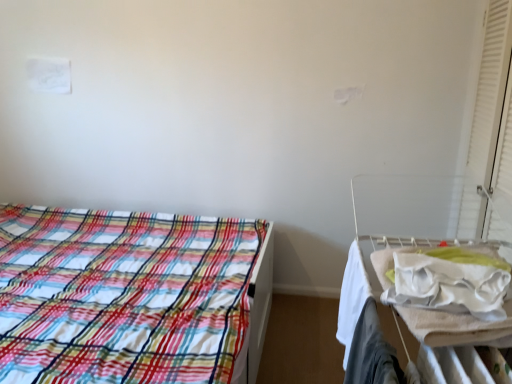
Describe the element at coordinates (422, 312) in the screenshot. This screenshot has width=512, height=384. I see `white fabric hospital bed at right` at that location.

Where is `white fabric at right`? Image resolution: width=512 pixels, height=384 pixels. white fabric at right is located at coordinates (372, 352).

The image size is (512, 384). I want to click on plaid fabric bed at left, so click(x=126, y=295).

In order to click on white fabric hospital bed at right in this screenshot , I will do `click(422, 312)`.

From a real-world perspective, which is physically above, white fabric at right or plaid fabric bed at left?

In real-world perspective, white fabric at right is above.

From the image's perspective, which one is positioned higher, white fabric at right or plaid fabric bed at left?

white fabric at right is shown above in the image.

Looking at this image, does white fabric at right have a lesser width compared to plaid fabric bed at left?

Yes.

Could you tell me if white fabric at right is turned towards plaid fabric bed at left?

No, white fabric at right does not turn towards plaid fabric bed at left.

Based on the photo, is plaid fabric bed at left surrounded by white matte curtain at right?

Actually, plaid fabric bed at left is outside white matte curtain at right.

Is white matte curtain at right touching plaid fabric bed at left?

No.

Is white matte curtain at right oriented away from plaid fabric bed at left?

No, plaid fabric bed at left is not at the back of white matte curtain at right.

Is white matte curtain at right in front of plaid fabric bed at left?

No, white matte curtain at right is further to the viewer.

From a real-world perspective, which is physically below, white fabric hospital bed at right or plaid fabric bed at left?

plaid fabric bed at left is physically lower.

Is white fabric hospital bed at right wider or thinner than plaid fabric bed at left?

In the image, white fabric hospital bed at right appears to be more narrow than plaid fabric bed at left.

Is white fabric hospital bed at right located outside plaid fabric bed at left?

Absolutely, white fabric hospital bed at right is external to plaid fabric bed at left.

From the picture: From the image's perspective, does white fabric hospital bed at right appear lower than plaid fabric bed at left?

Yes, from the image's perspective, white fabric hospital bed at right is below plaid fabric bed at left.

Is point (482, 133) in front of point (398, 374)?

No, (482, 133) is behind (398, 374).

Considering the positions of objects white matte curtain at right and white fabric at right in the image provided, who is in front, white matte curtain at right or white fabric at right?

white fabric at right is more forward.

Would you say white matte curtain at right contains white fabric at right?

No, white fabric at right is not inside white matte curtain at right.

Looking at this image, looking at the image, does white matte curtain at right seem bigger or smaller compared to white fabric at right?

Considering their sizes, white matte curtain at right takes up more space than white fabric at right.

Based on the photo, which of these two, plaid fabric bed at left or white fabric at right, is bigger?

Bigger between the two is plaid fabric bed at left.

Is plaid fabric bed at left facing towards white fabric at right?

No, plaid fabric bed at left is not facing towards white fabric at right.

Is plaid fabric bed at left positioned far away from white fabric at right?

Yes, plaid fabric bed at left and white fabric at right are located far from each other.

Is plaid fabric bed at left behind white matte curtain at right?

No, the depth of plaid fabric bed at left is less than that of white matte curtain at right.

From the image's perspective, is plaid fabric bed at left located beneath white matte curtain at right?

Indeed, from the image's perspective, plaid fabric bed at left is shown beneath white matte curtain at right.

Is plaid fabric bed at left thinner than white matte curtain at right?

No.

Is white matte curtain at right at the back of plaid fabric bed at left?

That's not correct — plaid fabric bed at left is not looking away from white matte curtain at right.

Is white fabric at right a part of white fabric hospital bed at right?

Indeed, white fabric at right is located within white fabric hospital bed at right.

In terms of size, does white fabric hospital bed at right appear bigger or smaller than white fabric at right?

Considering their sizes, white fabric hospital bed at right takes up more space than white fabric at right.

In the scene shown: In the image, is white fabric hospital bed at right on the left side or the right side of white fabric at right?

From the image, it's evident that white fabric hospital bed at right is to the right of white fabric at right.

Where is `clothing in front of the plaid fabric bed at left`? The height and width of the screenshot is (384, 512). clothing in front of the plaid fabric bed at left is located at coordinates (372, 352).

Where is `bed located underneath the white matte curtain at right (from a real-world perspective)`? bed located underneath the white matte curtain at right (from a real-world perspective) is located at coordinates (126, 295).

When comparing their distances from plaid fabric bed at left, does white matte curtain at right or white fabric at right seem closer?

Based on the image, white fabric at right appears to be nearer to plaid fabric bed at left.

Looking at the image, which one is located further to white fabric hospital bed at right, white matte curtain at right or plaid fabric bed at left?

Based on the image, plaid fabric bed at left appears to be further to white fabric hospital bed at right.

Looking at the image, which one is located further to plaid fabric bed at left, white fabric hospital bed at right or white fabric at right?

The object further to plaid fabric bed at left is white fabric at right.

In the scene shown: When comparing their distances from white matte curtain at right, does plaid fabric bed at left or white fabric hospital bed at right seem closer?

Among the two, white fabric hospital bed at right is located nearer to white matte curtain at right.

Based on their spatial positions, is white fabric hospital bed at right or white matte curtain at right further from plaid fabric bed at left?

white matte curtain at right is positioned further to the anchor plaid fabric bed at left.

Based on their spatial positions, is white fabric at right or white matte curtain at right closer to plaid fabric bed at left?

white fabric at right is closer to plaid fabric bed at left.

Looking at this image, considering their positions, is white fabric at right positioned closer to white matte curtain at right than white fabric hospital bed at right?

white fabric hospital bed at right lies closer to white matte curtain at right than the other object.

Considering their positions, is white fabric at right positioned closer to white fabric hospital bed at right than white matte curtain at right?

white fabric at right is positioned closer to the anchor white fabric hospital bed at right.

This screenshot has width=512, height=384. I want to click on clothing between plaid fabric bed at left and white fabric hospital bed at right from left to right, so tap(372, 352).

The width and height of the screenshot is (512, 384). I want to click on clothing between white matte curtain at right and white fabric hospital bed at right vertically, so click(372, 352).

This screenshot has width=512, height=384. Find the location of `hospital bed between plaid fabric bed at left and white matte curtain at right from left to right`. hospital bed between plaid fabric bed at left and white matte curtain at right from left to right is located at coordinates (422, 312).

Identify the location of clothing situated between plaid fabric bed at left and white matte curtain at right from left to right. The height and width of the screenshot is (384, 512). (372, 352).